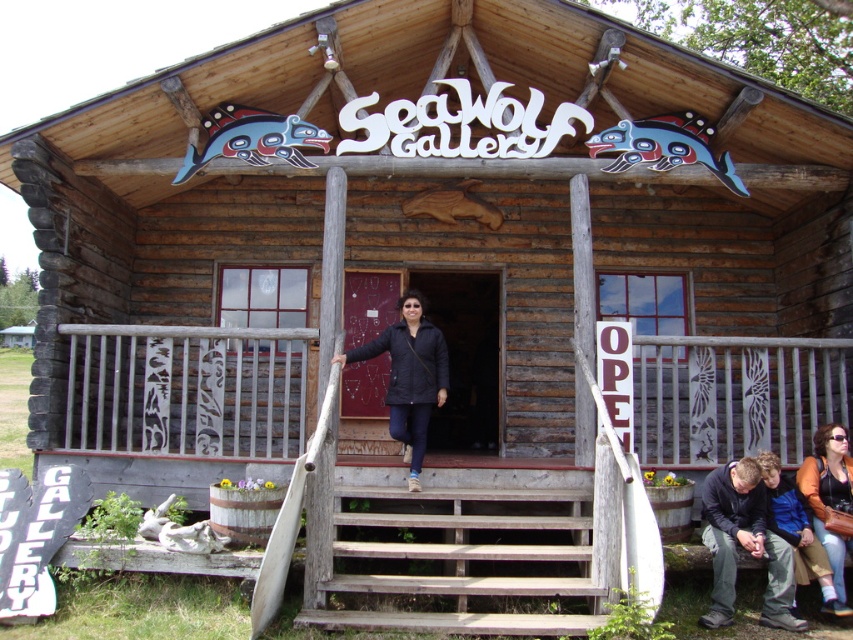
You are a visitor approaching the SeaWolf Gallery. You see the weathered wood stairs at center and the black matte jacket at center. Which object appears bigger in the image?

Result: The weathered wood stairs at center is larger in size than the black matte jacket at center, so the weathered wood stairs at center appears bigger in the image.

You are a visitor approaching the SeaWolf Gallery and notice two jackets near the entrance. The dark blue jacket at lower right and the orange fabric jacket at center. Which jacket is closer to the entrance steps?

The dark blue jacket at lower right is closer to the entrance steps because it is positioned under the orange fabric jacket at center, indicating it is lower in the scene.